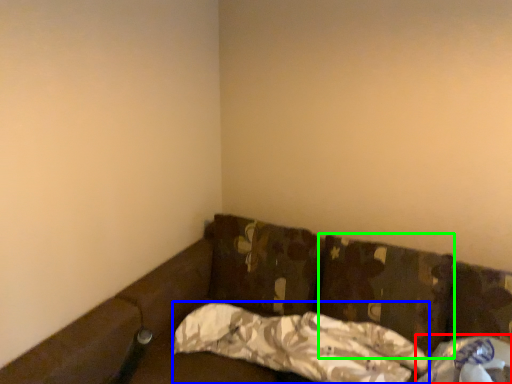
Question: Estimate the real-world distances between objects in this image. Which object is farther from material (highlighted by a red box), pillow (highlighted by a blue box) or pillow (highlighted by a green box)?

Choices:
 (A) pillow
 (B) pillow

Answer: (A)